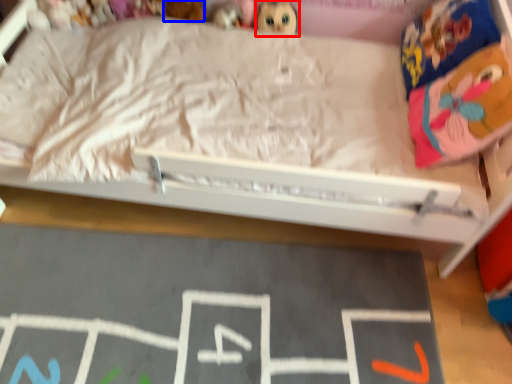
Question: Which point is further to the camera, toy (highlighted by a red box) or toy (highlighted by a blue box)?

Choices:
 (A) toy
 (B) toy

Answer: (A)